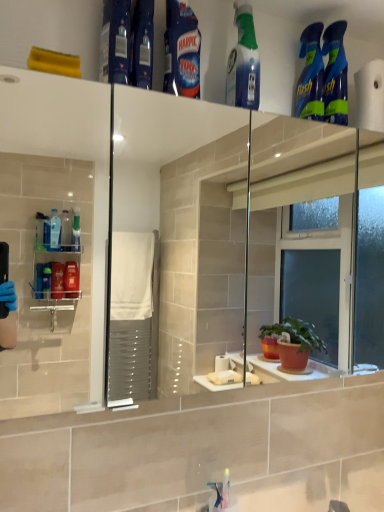
The width and height of the screenshot is (384, 512). Identify the location of blue glossy spray bottles at upper right, the 4th cleaning product positioned from the left. (310, 75).

Measure the distance between translucent plastic spray bottle at upper center, acting as the third cleaning product starting from the right, and camera.

translucent plastic spray bottle at upper center, acting as the third cleaning product starting from the right, is 36.98 inches away from camera.

The width and height of the screenshot is (384, 512). I want to click on translucent plastic spray bottle at upper center, acting as the third cleaning product starting from the right, so click(243, 63).

This screenshot has height=512, width=384. I want to click on white matte toilet paper at upper right, so click(370, 96).

How much space does blue glossy harpic at upper center, which is counted as the 2th cleaning product, starting from the left, occupy vertically?

10.33 inches.

What are the coordinates of `blue glossy spray bottle at upper left, which is the fifth cleaning product in right-to-left order` in the screenshot? It's located at (115, 42).

From the image's perspective, is translucent plastic spray bottle at upper center, the third cleaning product viewed from the left, located beneath white matte toilet paper at upper right?

No, from the image's perspective, translucent plastic spray bottle at upper center, the third cleaning product viewed from the left, is not below white matte toilet paper at upper right.

Find the location of a particular element. This screenshot has width=384, height=512. toilet paper located behind the translucent plastic spray bottle at upper center, the third cleaning product viewed from the left is located at coordinates (370, 96).

In the scene shown: Is translucent plastic spray bottle at upper center, the third cleaning product viewed from the left, facing towards white matte toilet paper at upper right?

No, translucent plastic spray bottle at upper center, the third cleaning product viewed from the left, is not turned towards white matte toilet paper at upper right.

Between blue glossy spray bottle at upper left, which is the fifth cleaning product in right-to-left order, and blue glossy spray bottles at upper right, which is the 1th cleaning product from right to left, which one has smaller size?

Smaller between the two is blue glossy spray bottles at upper right, which is the 1th cleaning product from right to left.

Based on the photo, is blue glossy spray bottle at upper left, which is the fifth cleaning product in right-to-left order, looking in the opposite direction of blue glossy spray bottles at upper right, which is the 1th cleaning product from right to left?

No, blue glossy spray bottle at upper left, which is the fifth cleaning product in right-to-left order,'s orientation is not away from blue glossy spray bottles at upper right, which is the 1th cleaning product from right to left.

Is blue glossy spray bottles at upper right, which is the 1th cleaning product from right to left, a part of blue glossy spray bottle at upper left, positioned as the first cleaning product in left-to-right order?

That's incorrect, blue glossy spray bottles at upper right, which is the 1th cleaning product from right to left, is not inside blue glossy spray bottle at upper left, positioned as the first cleaning product in left-to-right order.

How many degrees apart are the facing directions of blue glossy spray bottle at upper left, which is the fifth cleaning product in right-to-left order, and blue glossy spray bottles at upper right, the fifth cleaning product in the left-to-right sequence?

7.82 degrees.

Who is taller, blue plastic bottle at upper center or translucent plastic spray bottle at upper center, the third cleaning product viewed from the left?

Standing taller between the two is translucent plastic spray bottle at upper center, the third cleaning product viewed from the left.

Find the location of `toiletry above the translucent plastic spray bottle at upper center, the third cleaning product viewed from the left (from a real-world perspective)`. toiletry above the translucent plastic spray bottle at upper center, the third cleaning product viewed from the left (from a real-world perspective) is located at coordinates (142, 44).

Can you confirm if blue plastic bottle at upper center is smaller than translucent plastic spray bottle at upper center, acting as the third cleaning product starting from the right?

Yes.

From the image's perspective, which one is positioned lower, blue plastic bottle at upper center or translucent plastic spray bottle at upper center, acting as the third cleaning product starting from the right?

translucent plastic spray bottle at upper center, acting as the third cleaning product starting from the right.

Is blue glossy spray bottles at upper right, the fifth cleaning product in the left-to-right sequence, in contact with blue glossy spray bottle at upper left, positioned as the first cleaning product in left-to-right order?

blue glossy spray bottles at upper right, the fifth cleaning product in the left-to-right sequence, and blue glossy spray bottle at upper left, positioned as the first cleaning product in left-to-right order, are not in contact.

Who is bigger, blue glossy spray bottles at upper right, which is the 1th cleaning product from right to left, or blue glossy spray bottle at upper left, which is the fifth cleaning product in right-to-left order?

blue glossy spray bottle at upper left, which is the fifth cleaning product in right-to-left order.

Is blue glossy spray bottles at upper right, the 4th cleaning product positioned from the left, far away from white matte toilet paper at upper right?

No.

From a real-world perspective, between blue glossy spray bottles at upper right, which ranks as the second cleaning product in right-to-left order, and white matte toilet paper at upper right, who is vertically lower?

From a 3D spatial view, white matte toilet paper at upper right is below.

Is the position of blue glossy spray bottles at upper right, which ranks as the second cleaning product in right-to-left order, less distant than that of white matte toilet paper at upper right?

Yes, it is.

Does blue glossy spray bottles at upper right, which ranks as the second cleaning product in right-to-left order, turn towards white matte toilet paper at upper right?

No, blue glossy spray bottles at upper right, which ranks as the second cleaning product in right-to-left order, is not turned towards white matte toilet paper at upper right.

Which is correct: translucent plastic spray bottle at upper center, acting as the third cleaning product starting from the right, is inside blue glossy spray bottle at upper left, positioned as the first cleaning product in left-to-right order, or outside of it?

translucent plastic spray bottle at upper center, acting as the third cleaning product starting from the right, is located beyond the bounds of blue glossy spray bottle at upper left, positioned as the first cleaning product in left-to-right order.

Considering the sizes of objects translucent plastic spray bottle at upper center, acting as the third cleaning product starting from the right, and blue glossy spray bottle at upper left, positioned as the first cleaning product in left-to-right order, in the image provided, who is shorter, translucent plastic spray bottle at upper center, acting as the third cleaning product starting from the right, or blue glossy spray bottle at upper left, positioned as the first cleaning product in left-to-right order,?

With less height is blue glossy spray bottle at upper left, positioned as the first cleaning product in left-to-right order.

Could you tell me if translucent plastic spray bottle at upper center, the third cleaning product viewed from the left, is facing blue glossy spray bottle at upper left, positioned as the first cleaning product in left-to-right order?

No, translucent plastic spray bottle at upper center, the third cleaning product viewed from the left, is not facing towards blue glossy spray bottle at upper left, positioned as the first cleaning product in left-to-right order.

From the image's perspective, is white matte toilet paper at upper right located above or below blue glossy spray bottles at upper right, which is the 1th cleaning product from right to left?

From the image's perspective, white matte toilet paper at upper right appears below blue glossy spray bottles at upper right, which is the 1th cleaning product from right to left.

Can you confirm if white matte toilet paper at upper right is bigger than blue glossy spray bottles at upper right, the fifth cleaning product in the left-to-right sequence?

Correct, white matte toilet paper at upper right is larger in size than blue glossy spray bottles at upper right, the fifth cleaning product in the left-to-right sequence.

Considering the relative sizes of white matte toilet paper at upper right and blue glossy spray bottles at upper right, which is the 1th cleaning product from right to left, in the image provided, is white matte toilet paper at upper right thinner than blue glossy spray bottles at upper right, which is the 1th cleaning product from right to left,?

Indeed, white matte toilet paper at upper right has a lesser width compared to blue glossy spray bottles at upper right, which is the 1th cleaning product from right to left.

Looking at this image, could you tell me if white matte toilet paper at upper right is turned towards blue glossy spray bottles at upper right, which is the 1th cleaning product from right to left?

No, white matte toilet paper at upper right is not facing towards blue glossy spray bottles at upper right, which is the 1th cleaning product from right to left.

What are the coordinates of `the 3rd cleaning product to the left when counting from the white matte toilet paper at upper right` in the screenshot? It's located at (243, 63).

From the blue glossy spray bottle at upper left, which is the fifth cleaning product in right-to-left order, count 4th cleaning product to the right and point to it. Please provide its 2D coordinates.

[(335, 74)]

Which object lies further to the anchor point blue plastic bottle at upper center, translucent plastic spray bottle at upper center, the third cleaning product viewed from the left, or white matte toilet paper at upper right?

The object further to blue plastic bottle at upper center is white matte toilet paper at upper right.

From the image, which object appears to be nearer to blue glossy spray bottles at upper right, the fifth cleaning product in the left-to-right sequence, blue glossy spray bottles at upper right, which ranks as the second cleaning product in right-to-left order, or white matte toilet paper at upper right?

blue glossy spray bottles at upper right, which ranks as the second cleaning product in right-to-left order.

Estimate the real-world distances between objects in this image. Which object is further from translucent plastic spray bottle at upper center, acting as the third cleaning product starting from the right, blue glossy spray bottle at upper left, positioned as the first cleaning product in left-to-right order, or blue glossy spray bottles at upper right, the fifth cleaning product in the left-to-right sequence?

Based on the image, blue glossy spray bottle at upper left, positioned as the first cleaning product in left-to-right order, appears to be further to translucent plastic spray bottle at upper center, acting as the third cleaning product starting from the right.

Considering their positions, is translucent plastic spray bottle at upper center, the third cleaning product viewed from the left, positioned closer to blue plastic bottle at upper center than blue glossy spray bottle at upper left, positioned as the first cleaning product in left-to-right order?

blue glossy spray bottle at upper left, positioned as the first cleaning product in left-to-right order.

Estimate the real-world distances between objects in this image. Which object is further from blue glossy spray bottle at upper left, which is the fifth cleaning product in right-to-left order, blue plastic bottle at upper center or white matte toilet paper at upper right?

Among the two, white matte toilet paper at upper right is located further to blue glossy spray bottle at upper left, which is the fifth cleaning product in right-to-left order.

Considering their positions, is blue plastic bottle at upper center positioned closer to translucent plastic spray bottle at upper center, acting as the third cleaning product starting from the right, than blue glossy harpic at upper center, marked as the 4th cleaning product in a right-to-left arrangement?

Based on the image, blue glossy harpic at upper center, marked as the 4th cleaning product in a right-to-left arrangement, appears to be nearer to translucent plastic spray bottle at upper center, acting as the third cleaning product starting from the right.

Which object lies further to the anchor point blue glossy spray bottles at upper right, which is the 1th cleaning product from right to left, blue glossy spray bottles at upper right, which ranks as the second cleaning product in right-to-left order, or blue glossy spray bottle at upper left, which is the fifth cleaning product in right-to-left order?

blue glossy spray bottle at upper left, which is the fifth cleaning product in right-to-left order, is further to blue glossy spray bottles at upper right, which is the 1th cleaning product from right to left.

Which object lies nearer to the anchor point white matte toilet paper at upper right, blue glossy spray bottle at upper left, which is the fifth cleaning product in right-to-left order, or translucent plastic spray bottle at upper center, the third cleaning product viewed from the left?

translucent plastic spray bottle at upper center, the third cleaning product viewed from the left, is closer to white matte toilet paper at upper right.

This screenshot has width=384, height=512. What are the coordinates of `toiletry between blue glossy spray bottle at upper left, which is the fifth cleaning product in right-to-left order, and blue glossy spray bottles at upper right, the 4th cleaning product positioned from the left, from left to right` in the screenshot? It's located at (142, 44).

Locate an element on the screen. toiletry between blue glossy spray bottle at upper left, positioned as the first cleaning product in left-to-right order, and blue glossy spray bottles at upper right, the fifth cleaning product in the left-to-right sequence, in the horizontal direction is located at coordinates (142, 44).

The height and width of the screenshot is (512, 384). What are the coordinates of `cleaning product between translucent plastic spray bottle at upper center, the third cleaning product viewed from the left, and blue glossy spray bottles at upper right, the fifth cleaning product in the left-to-right sequence` in the screenshot? It's located at (310, 75).

Where is `cleaning product between blue glossy spray bottles at upper right, the 4th cleaning product positioned from the left, and white matte toilet paper at upper right, in the horizontal direction`? This screenshot has height=512, width=384. cleaning product between blue glossy spray bottles at upper right, the 4th cleaning product positioned from the left, and white matte toilet paper at upper right, in the horizontal direction is located at coordinates (335, 74).